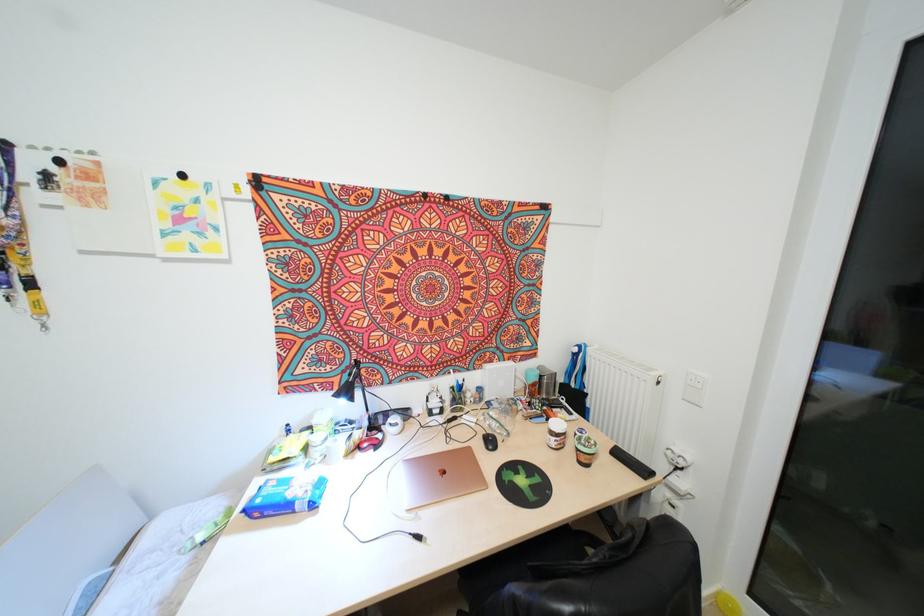
Where would you adjust the black lamp head? Please return your answer as a coordinate pair (x, y).

(354, 389)